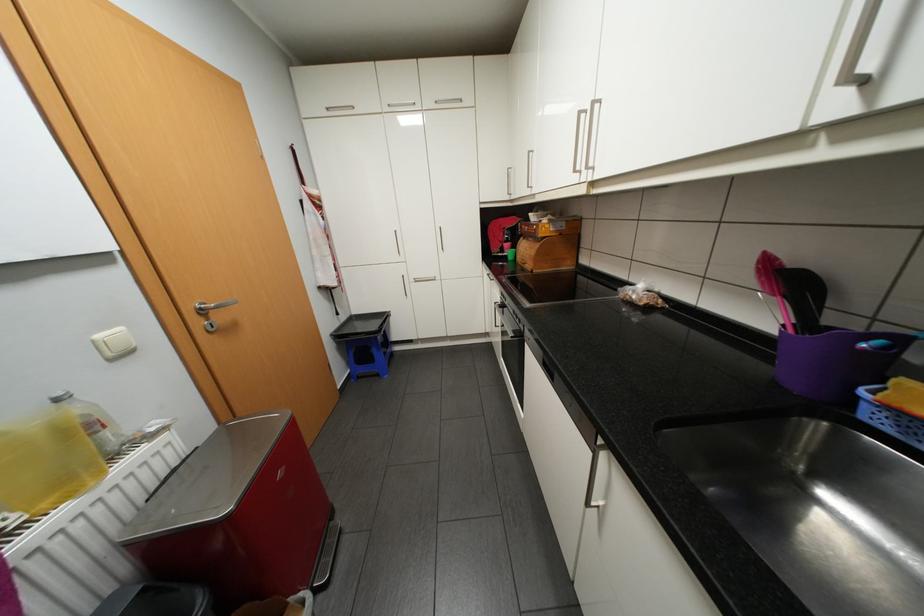
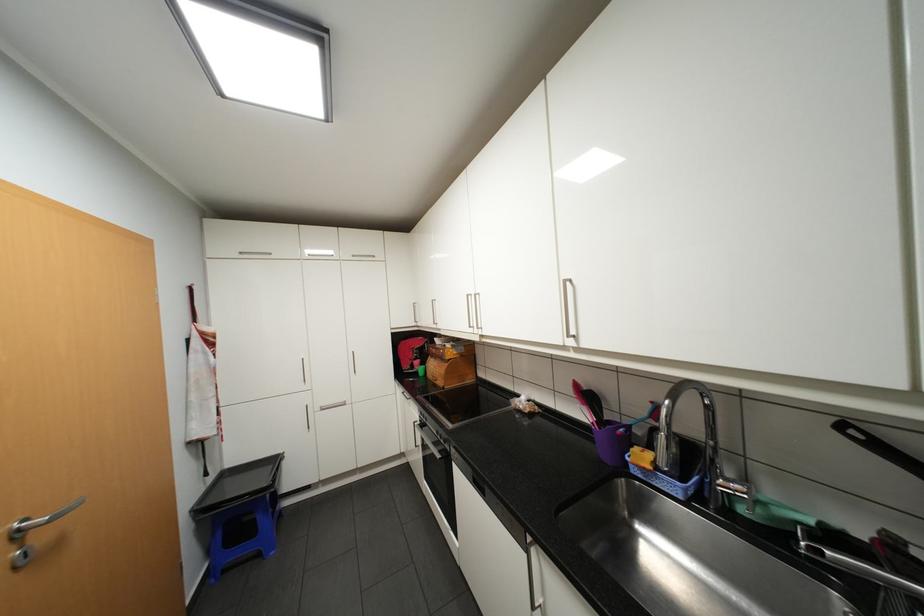
In the second image, find the point that corresponds to (x=209, y=308) in the first image.

(27, 530)